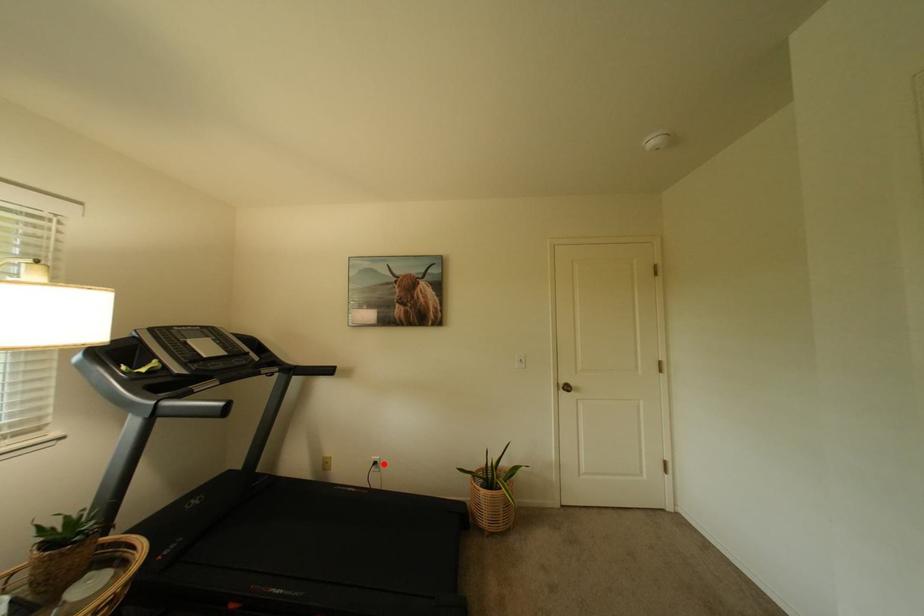
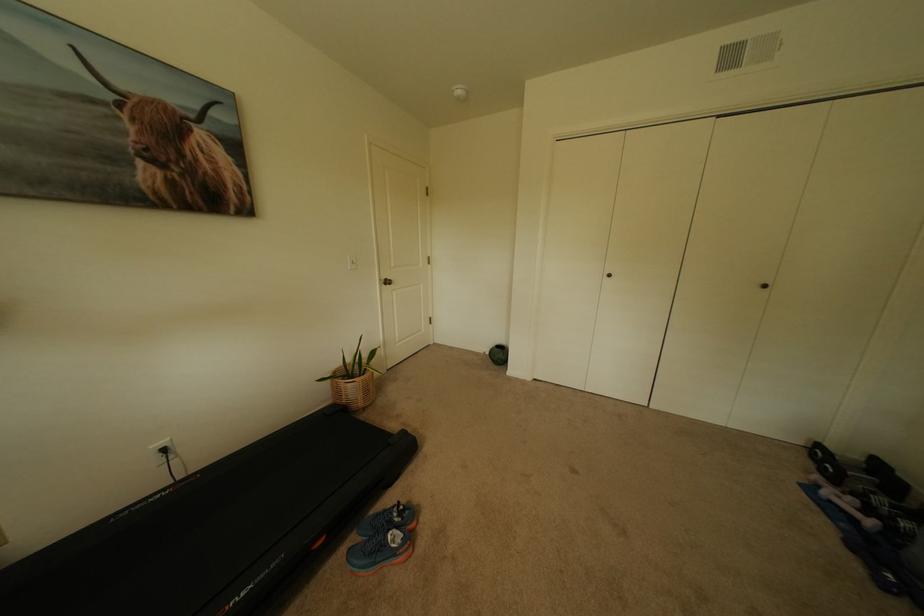
The point at the highlighted location is marked in the first image. Where is the corresponding point in the second image?

(173, 451)